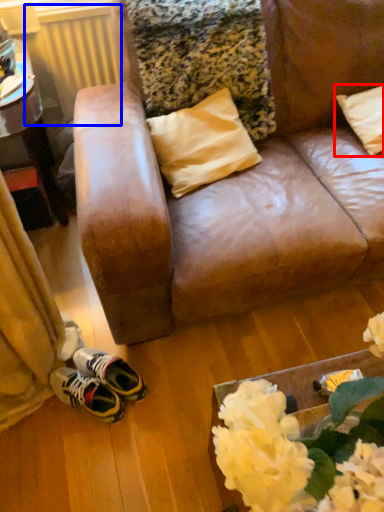
Question: Which object appears closest to the camera in this image, pillow (highlighted by a red box) or radiator (highlighted by a blue box)?

Choices:
 (A) pillow
 (B) radiator

Answer: (A)